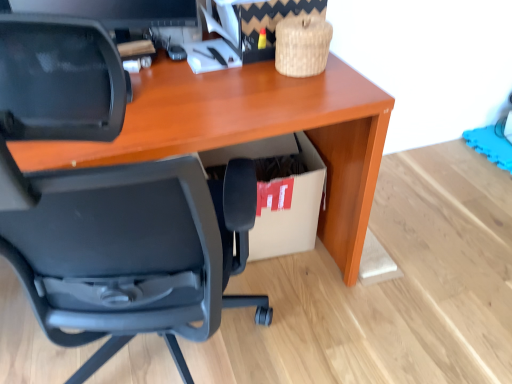
The image size is (512, 384). In order to click on free space on the front side of cardboard box at lower right in this screenshot , I will do `click(284, 300)`.